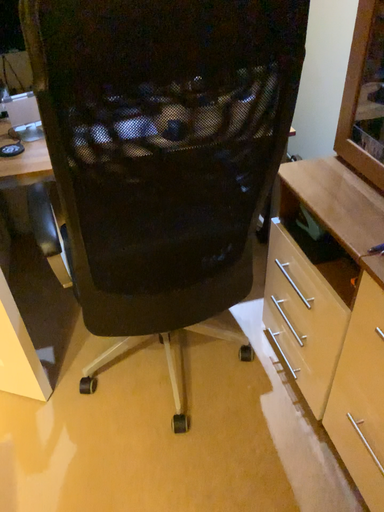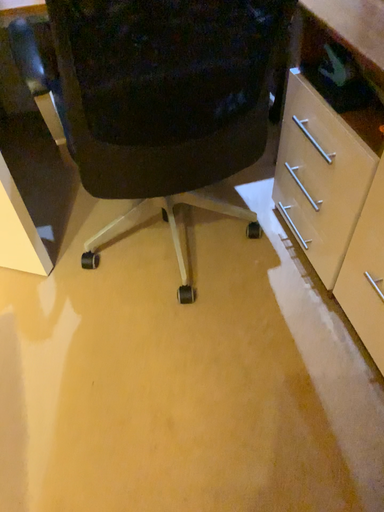
Question: How did the camera likely rotate when shooting the video?

Choices:
 (A) rotated upward
 (B) rotated downward

Answer: (B)